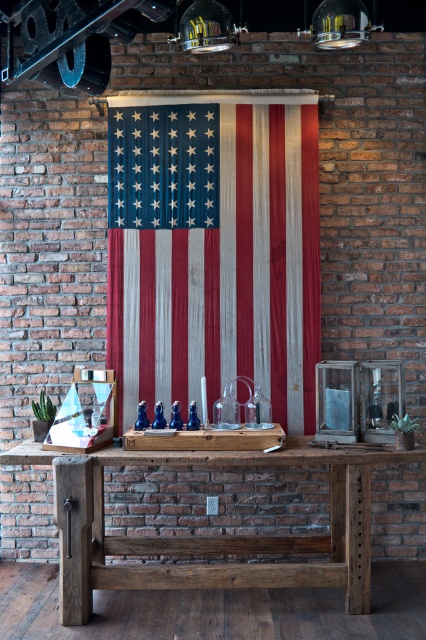
You are standing in front of the rustic wood table at center and want to place the vintage lantern on the rustic wood american flag at center. Can you reach the flag from your current position without moving the table?

The rustic wood american flag at center is further to the viewer than rustic wood table at center, so the table is closer to you. Since the table is between you and the flag, you cannot reach the flag without moving the table.

You are planning to hang a new painting that is 1.2 meters wide on the brick wall where the rustic wood american flag at center is currently displayed. Given the current setup, do you think the painting will fit in the same space without overlapping the rustic wood table at center?

The rustic wood american flag at center has a lesser width compared to rustic wood table at center. Since the painting is 1.2 meters wide, it depends on the table width. But since the flag is narrower than the table, if the table is wider than 1.2 meters, the painting might fit without overlapping. However, without exact measurements of the table, we can only infer based on the flag. If the flag is narrower than 1.2m, the painting may be wider than the flag but still need to check table width. This answer,